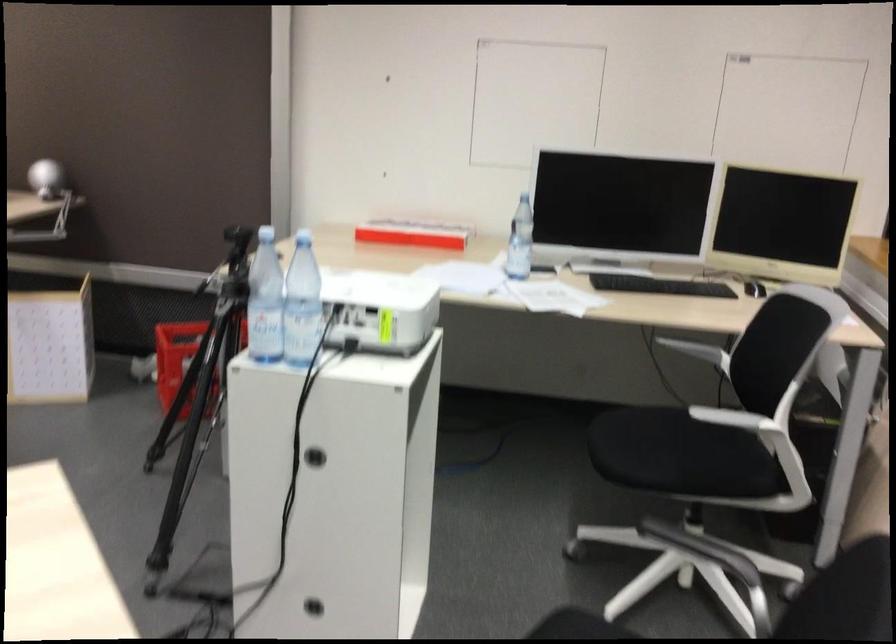
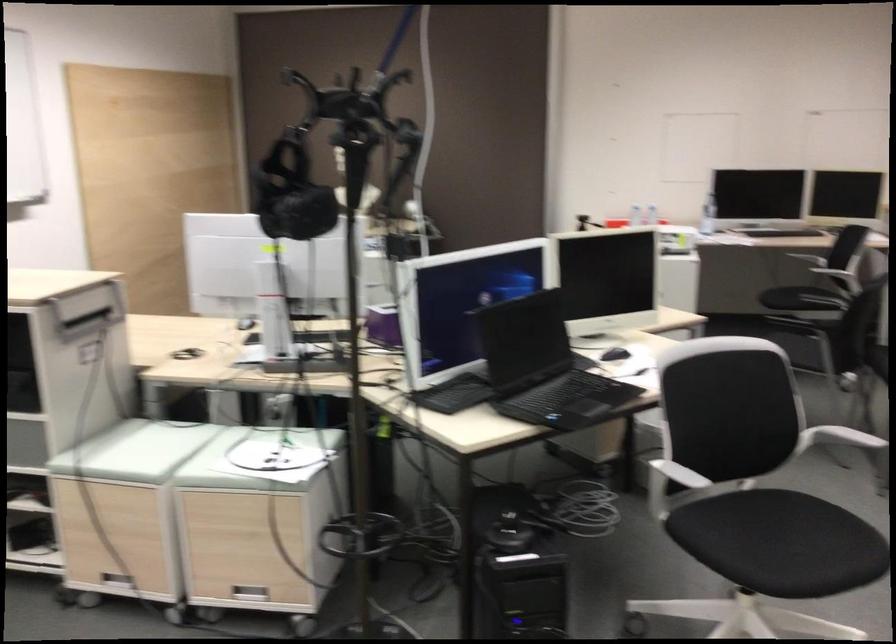
Question: I am providing you with two images of the same scene from different viewpoints. After the viewpoint changes to image2, which objects are now occluded?

Choices:
 (A) cabinet hole handle
 (B) grey oven mitt
 (C) black chair sitting surface
 (D) metal drawer handle

Answer: (A)